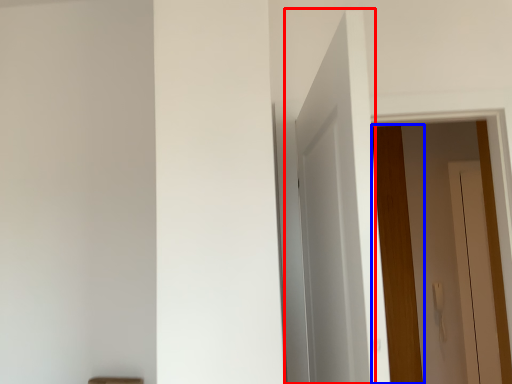
Question: Which of the following is the farthest to the observer, door (highlighted by a red box) or door (highlighted by a blue box)?

Choices:
 (A) door
 (B) door

Answer: (B)